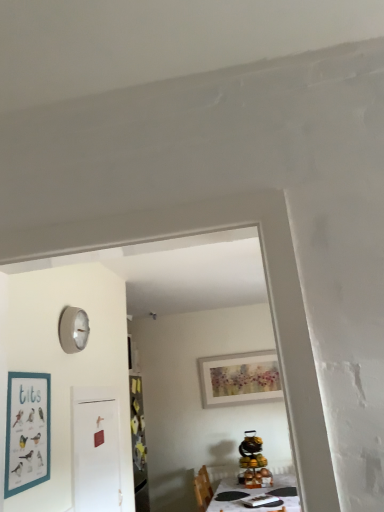
Question: Can you confirm if watercolor paper picture frame at upper center, arranged as the 2th picture frame when viewed from the front, is thinner than white glossy table at lower center?

Choices:
 (A) yes
 (B) no

Answer: (A)

Question: Is watercolor paper picture frame at upper center, which appears as the first picture frame when viewed from the back, closer to the viewer compared to white glossy table at lower center?

Choices:
 (A) yes
 (B) no

Answer: (B)

Question: From a real-world perspective, does watercolor paper picture frame at upper center, positioned as the second picture frame in top-to-bottom order, stand above white glossy table at lower center?

Choices:
 (A) yes
 (B) no

Answer: (A)

Question: Is watercolor paper picture frame at upper center, arranged as the 2th picture frame when viewed from the front, turned away from white glossy table at lower center?

Choices:
 (A) yes
 (B) no

Answer: (B)

Question: Could you tell me if watercolor paper picture frame at upper center, arranged as the 2th picture frame when viewed from the front, is turned towards white glossy table at lower center?

Choices:
 (A) yes
 (B) no

Answer: (B)

Question: Considering the relative positions of watercolor paper picture frame at upper center, positioned as the second picture frame in top-to-bottom order, and white glossy table at lower center in the image provided, is watercolor paper picture frame at upper center, positioned as the second picture frame in top-to-bottom order, to the left or to the right of white glossy table at lower center?

Choices:
 (A) right
 (B) left

Answer: (A)

Question: Considering the positions of watercolor paper picture frame at upper center, the 1th picture frame positioned from the bottom, and white glossy table at lower center in the image, is watercolor paper picture frame at upper center, the 1th picture frame positioned from the bottom, bigger or smaller than white glossy table at lower center?

Choices:
 (A) small
 (B) big

Answer: (A)

Question: Considering the positions of watercolor paper picture frame at upper center, arranged as the 1th picture frame when viewed from the right, and white glossy table at lower center in the image, is watercolor paper picture frame at upper center, arranged as the 1th picture frame when viewed from the right, wider or thinner than white glossy table at lower center?

Choices:
 (A) wide
 (B) thin

Answer: (B)

Question: From a real-world perspective, is watercolor paper picture frame at upper center, the 1th picture frame positioned from the bottom, above or below white glossy table at lower center?

Choices:
 (A) below
 (B) above

Answer: (B)

Question: From the image's perspective, is watercolor paper picture frame at upper center, arranged as the 2th picture frame when viewed from the front, located above or below teal matte picture frame at left, the first picture frame from the front?

Choices:
 (A) above
 (B) below

Answer: (B)

Question: In terms of width, does watercolor paper picture frame at upper center, positioned as the second picture frame in top-to-bottom order, look wider or thinner when compared to teal matte picture frame at left, marked as the second picture frame in a right-to-left arrangement?

Choices:
 (A) thin
 (B) wide

Answer: (B)

Question: In the image, is watercolor paper picture frame at upper center, the 1th picture frame positioned from the bottom, on the left side or the right side of teal matte picture frame at left, the 2th picture frame viewed from the back?

Choices:
 (A) left
 (B) right

Answer: (B)

Question: Is watercolor paper picture frame at upper center, arranged as the 2th picture frame when viewed from the front, situated inside teal matte picture frame at left, the 1th picture frame in the left-to-right sequence, or outside?

Choices:
 (A) inside
 (B) outside

Answer: (B)

Question: Considering their positions, is white glossy table at lower center located in front of or behind watercolor paper picture frame at upper center, arranged as the 2th picture frame when viewed from the front?

Choices:
 (A) behind
 (B) front

Answer: (B)

Question: Would you say white glossy table at lower center is to the left or to the right of watercolor paper picture frame at upper center, arranged as the 2th picture frame when viewed from the front, in the picture?

Choices:
 (A) right
 (B) left

Answer: (B)